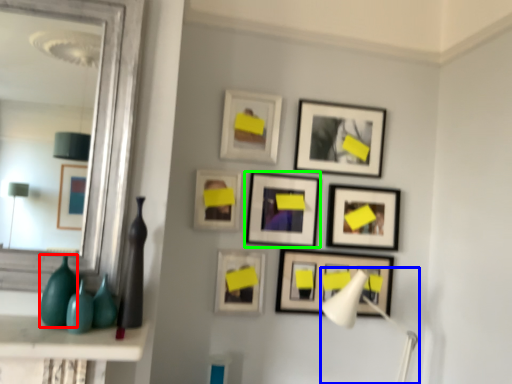
Question: Considering the real-world distances, which object is farthest from glass vase (highlighted by a red box)? table lamp (highlighted by a blue box) or picture frame (highlighted by a green box)?

Choices:
 (A) table lamp
 (B) picture frame

Answer: (A)